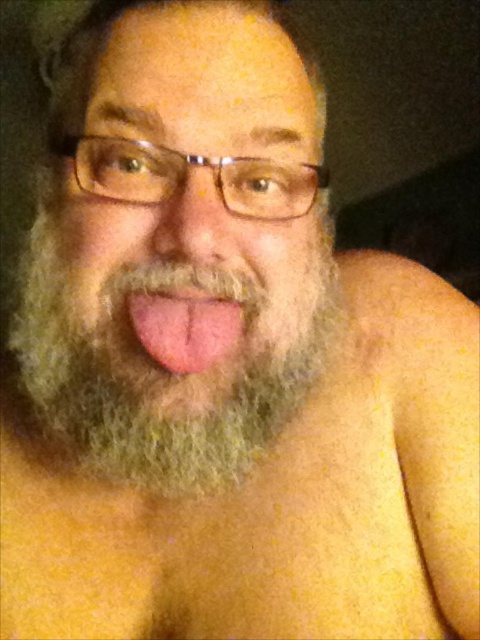
Question: Which point is farther to the camera?

Choices:
 (A) (181, 310)
 (B) (152, 17)

Answer: (B)

Question: Among these objects, which one is nearest to the camera?

Choices:
 (A) pink flesh at center
 (B) gray beard at center
 (C) gray fuzzy beard at center

Answer: (C)

Question: Observing the image, what is the correct spatial positioning of gray beard at center in reference to gray fuzzy beard at center?

Choices:
 (A) above
 (B) below

Answer: (A)

Question: Can you confirm if gray beard at center is positioned above gray fuzzy beard at center?

Choices:
 (A) yes
 (B) no

Answer: (A)

Question: Which point is farther from the camera taking this photo?

Choices:
 (A) (134, 353)
 (B) (164, 490)
 (C) (233, 321)

Answer: (B)

Question: Does gray beard at center have a smaller size compared to pink flesh at center?

Choices:
 (A) yes
 (B) no

Answer: (B)